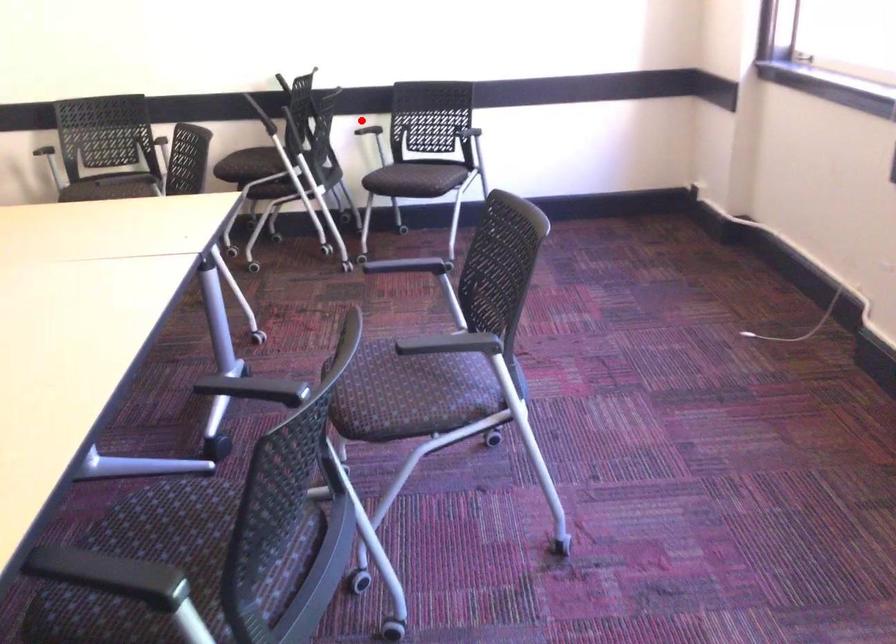
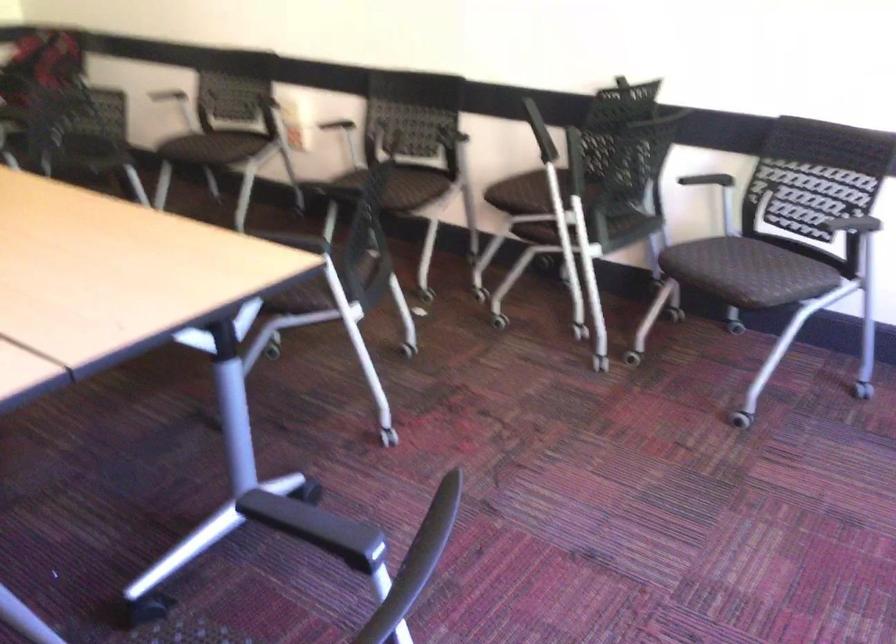
Where in the second image is the point corresponding to the highlighted location from the first image?

(718, 169)